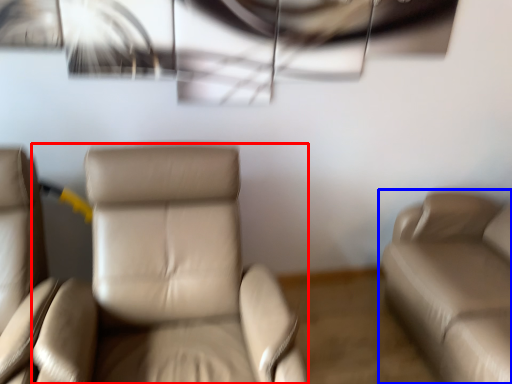
Question: Which point is closer to the camera, chair (highlighted by a red box) or studio couch (highlighted by a blue box)?

Choices:
 (A) chair
 (B) studio couch

Answer: (A)